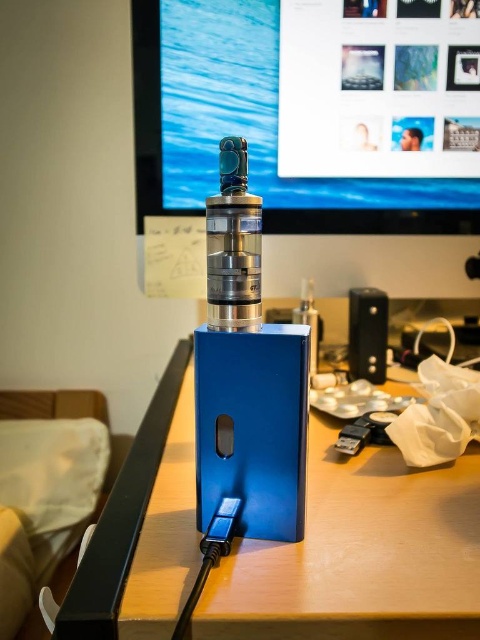
Please provide the 2D coordinates of the matte black monitor at upper center in the scene.

The 2D coordinates of the matte black monitor at upper center are at point (312, 109).

You are setting up a desk and need to place a new object between the matte black monitor at upper center and the blue metallic box at center. Can you tell me which object is located higher so you know where to place the new item?

The matte black monitor at upper center is above the blue metallic box at center, so you should place the new object between them by positioning it below the monitor and above the box.

You are standing 1.0 meters away from the camera. You want to reach a point that is at coordinates point (271, 182). Is the point closer to you or farther away than your current position?

The point point (271, 182) is 1.06 meters away from the camera. Since you are standing 1.0 meters away from the camera, the point is farther away than your current position.